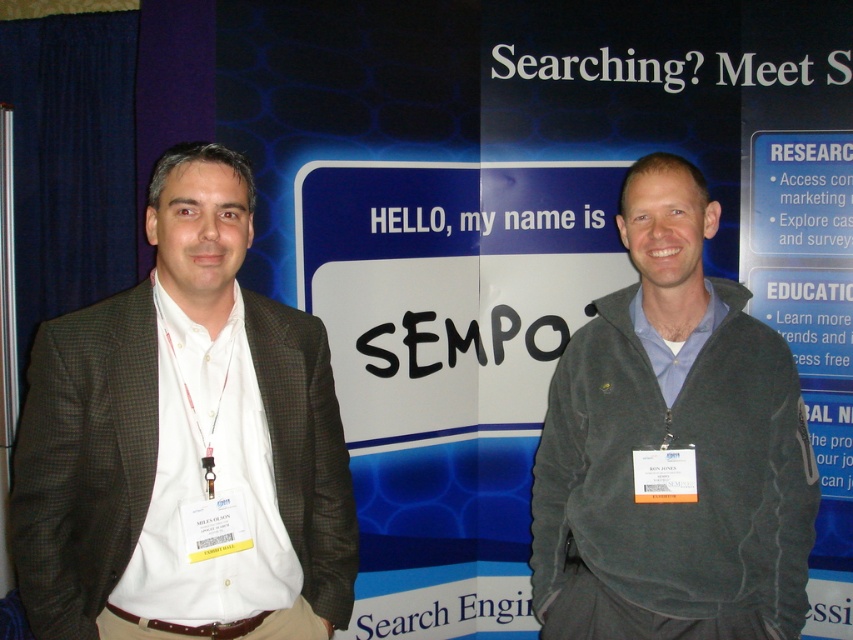
You are attending an SEMPO conference and need to identify which attendee is wearing a smaller outfit between the matte black suit at left and the dark gray fleece jacket at right. Which one should you point out?

The matte black suit at left has a smaller size compared to dark gray fleece jacket at right, so you should point out the matte black suit at left.